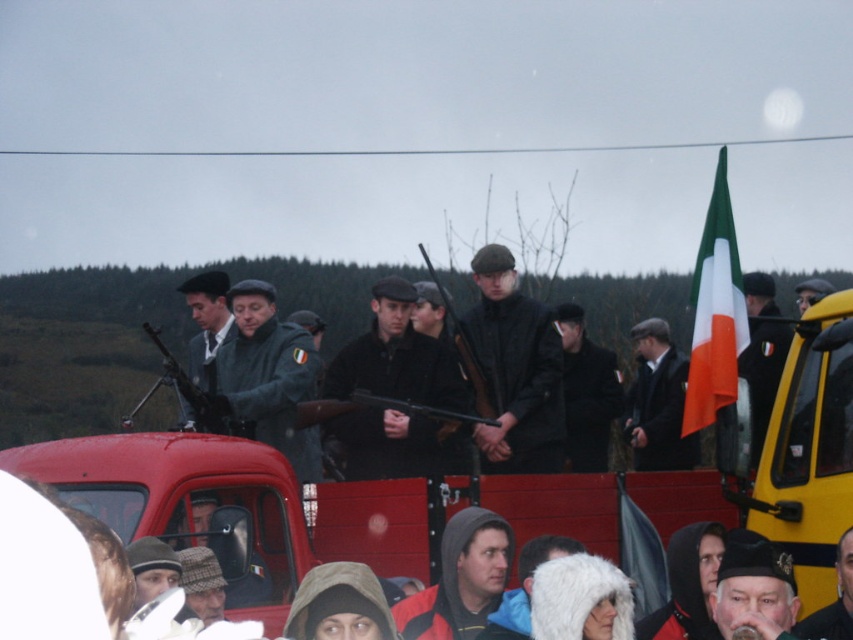
Is point (491, 337) positioned before point (306, 436)?

No.

Which of these two, matte black jacket at center or matte green jacket at center, stands shorter?

matte green jacket at center is shorter.

What are the coordinates of `matte black jacket at center` in the screenshot? It's located at (515, 369).

At what (x,y) coordinates should I click in order to perform the action: click on matte black jacket at center. Please return your answer as a coordinate pair (x, y). Looking at the image, I should click on tap(515, 369).

Who is positioned more to the right, black matte jacket at center or dark matte coat at center?

dark matte coat at center is more to the right.

Can you confirm if black matte jacket at center is wider than dark matte coat at center?

Correct, the width of black matte jacket at center exceeds that of dark matte coat at center.

Is point (412, 429) positioned behind point (582, 422)?

No, (412, 429) is in front of (582, 422).

The width and height of the screenshot is (853, 640). I want to click on black matte jacket at center, so click(x=397, y=356).

Is black matte jacket at center below matte green jacket at center?

Yes.

Does black matte jacket at center have a lesser width compared to matte green jacket at center?

Yes.

The image size is (853, 640). Find the location of `black matte jacket at center`. black matte jacket at center is located at coordinates (397, 356).

Locate an element on the screen. This screenshot has width=853, height=640. black matte jacket at center is located at coordinates (397, 356).